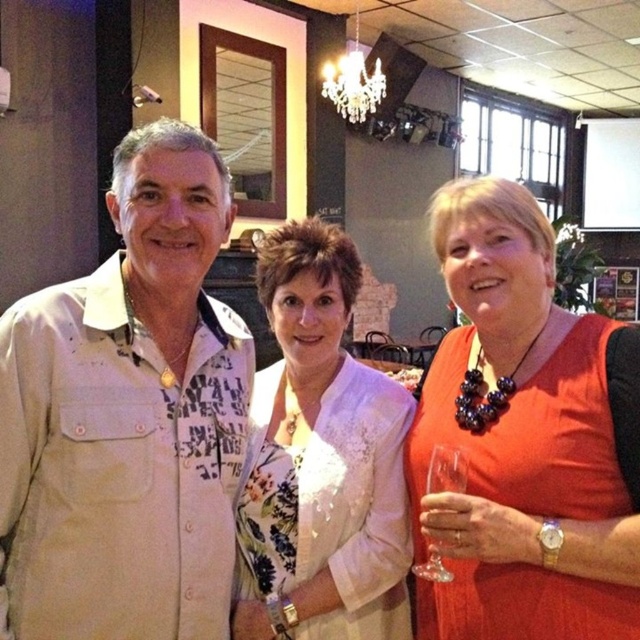
You are a photographer setting up for an event at this restaurant. You need to ensure that the orange fabric dress at center and the clear glass wine glass at lower right are both visible in your shot. Considering their sizes, which object will require more space in the frame to capture fully?

The orange fabric dress at center requires more space in the frame because its width is larger than the clear glass wine glass at lower right.

You are a photographer at the event and need to ensure both the beige cotton shirt at center and the orange fabric dress at center are fully visible in the photo. Which clothing item requires more space in the frame?

The orange fabric dress at center requires more space in the frame because it occupies more space than the beige cotton shirt at center.

You are a waiter at the restaurant and need to place a new wine glass on the table. The table already has the white floral blouse at center and the clear glass wine glass at lower right. Where should you place the new glass to avoid covering the blouse?

The white floral blouse at center is located above the clear glass wine glass at lower right, so placing the new wine glass below the existing clear glass wine glass at lower right would avoid covering the blouse.